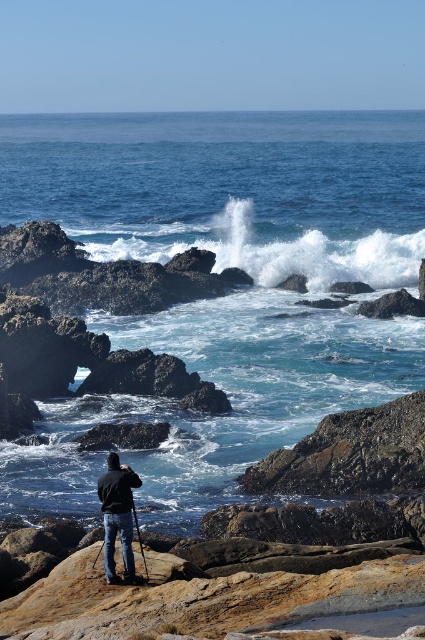
Question: Is white frothy wave at center closer to the viewer compared to black matte jacket at center?

Choices:
 (A) yes
 (B) no

Answer: (B)

Question: Which object appears closest to the camera in this image?

Choices:
 (A) blue water at center
 (B) white frothy wave at center
 (C) black matte jacket at center

Answer: (C)

Question: Which point appears closest to the camera in this image?

Choices:
 (A) (102, 122)
 (B) (150, 218)
 (C) (118, 497)

Answer: (C)

Question: Which point is farther to the camera?

Choices:
 (A) blue water at center
 (B) black matte jacket at center

Answer: (A)

Question: Does blue water at center appear on the left side of white frothy wave at center?

Choices:
 (A) no
 (B) yes

Answer: (B)

Question: Does white frothy wave at center have a greater width compared to black matte jacket at center?

Choices:
 (A) no
 (B) yes

Answer: (B)